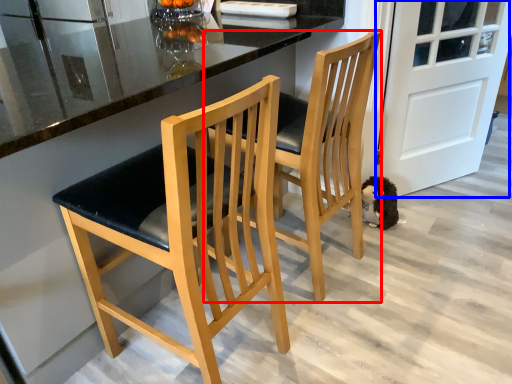
Question: Which of the following is the farthest to the observer, chair (highlighted by a red box) or door (highlighted by a blue box)?

Choices:
 (A) chair
 (B) door

Answer: (B)